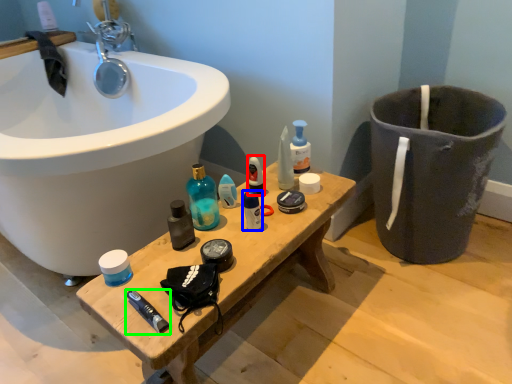
Question: Estimate the real-world distances between objects in this image. Which object is farther from mouthwash (highlighted by a red box), toiletry (highlighted by a blue box) or toothpaste (highlighted by a green box)?

Choices:
 (A) toiletry
 (B) toothpaste

Answer: (B)